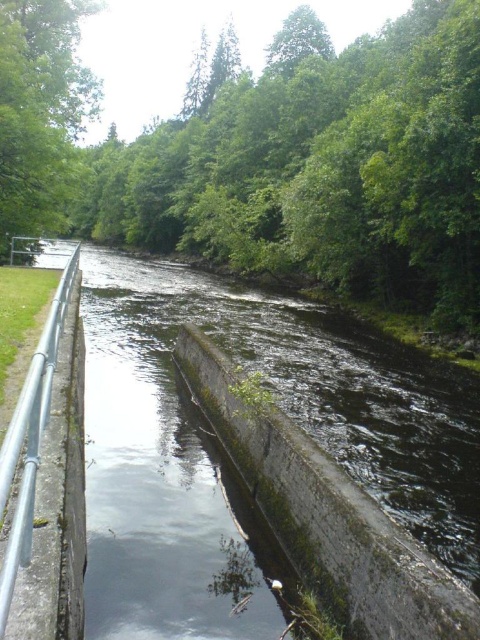
You are a hiker trying to cross the river using the walkway. The dark green concrete at center and the green leafy tree at upper left are in your path. Which one do you think is wider, making it easier to step on?

The dark green concrete at center is wider than the green leafy tree at upper left, so it would be easier to step on the dark green concrete at center.

You are standing at the riverbank and want to walk from point (33, 113) to point (23, 438). Which direction should you face to move towards the latter point?

You should face away from the viewer because point (23, 438) is further away from you than point (33, 113).

You are a hiker walking along the river and want to cross to the other side. You see the dark green concrete at center and the silver metallic rail at left. Which object is closer to your current position if you are standing on the path next to the rail?

The silver metallic rail at left is closer to your current position because you are standing on the path next to it, while the dark green concrete at center is further away to the right.